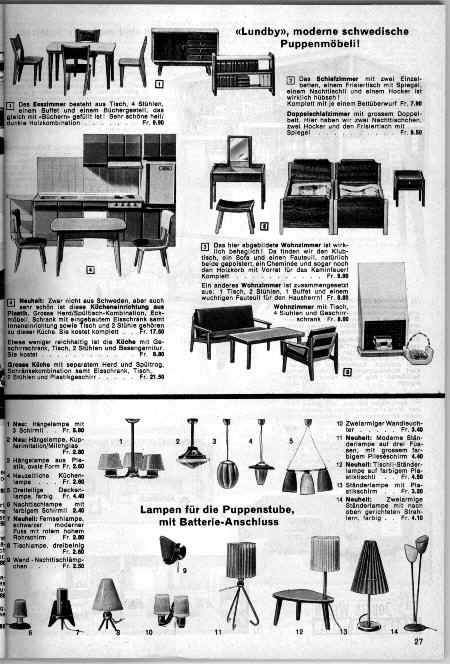
Find the location of `places to sit`. places to sit is located at coordinates (28, 64), (73, 64), (138, 58), (32, 242), (154, 244), (234, 207), (209, 327), (310, 345).